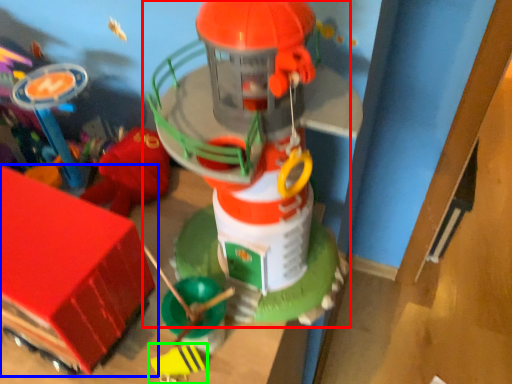
Question: Which object is positioned closest to toy (highlighted by a red box)? Select from toy (highlighted by a blue box) and toy (highlighted by a green box).

Choices:
 (A) toy
 (B) toy

Answer: (A)